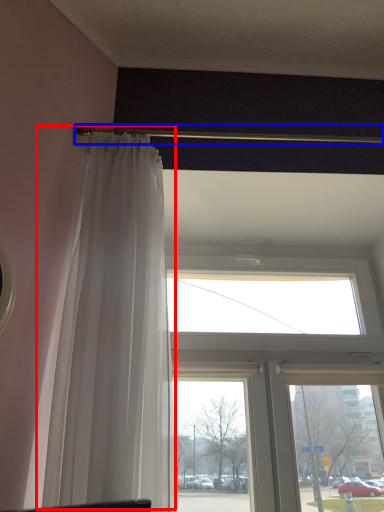
Question: Among these objects, which one is nearest to the camera, curtain (highlighted by a red box) or beam (highlighted by a blue box)?

Choices:
 (A) curtain
 (B) beam

Answer: (A)